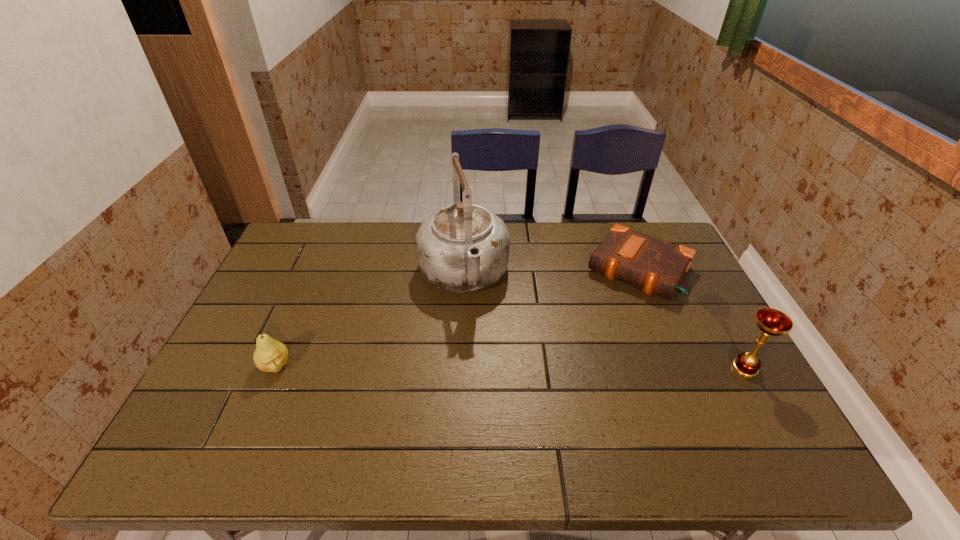
Where is `vacant space located at the spout of the kettle`? vacant space located at the spout of the kettle is located at coordinates (494, 404).

Identify the location of blank space located 0.080m on the spine side of the Bible. (608, 314).

At what (x,y) coordinates should I click in order to perform the action: click on free space located on the spine side of the Bible. Please return your answer as a coordinate pair (x, y). Looking at the image, I should click on (583, 353).

At what (x,y) coordinates should I click in order to perform the action: click on free space located 0.150m on the spine side of the Bible. Please return your answer as a coordinate pair (x, y). Looking at the image, I should click on (598, 329).

Locate an element on the screen. The image size is (960, 540). kettle present at the far edge is located at coordinates click(462, 248).

Image resolution: width=960 pixels, height=540 pixels. What are the coordinates of `Bible at the far edge` in the screenshot? It's located at (656, 266).

Where is `object present at the left edge`? This screenshot has width=960, height=540. object present at the left edge is located at coordinates (270, 355).

Find the location of a particular element. chalice located in the right edge section of the desktop is located at coordinates (770, 321).

Find the location of `Bible that is at the right edge`. Bible that is at the right edge is located at coordinates (656, 266).

Identify the location of object located in the far right corner section of the desktop. Image resolution: width=960 pixels, height=540 pixels. (656, 266).